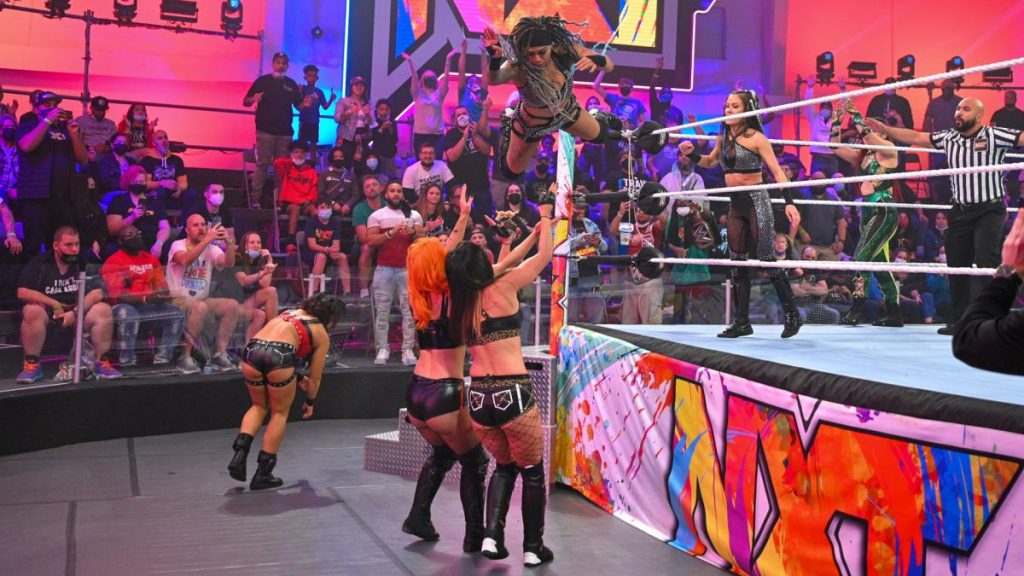
Find the location of a particular element. wrestling mat is located at coordinates (842, 380).